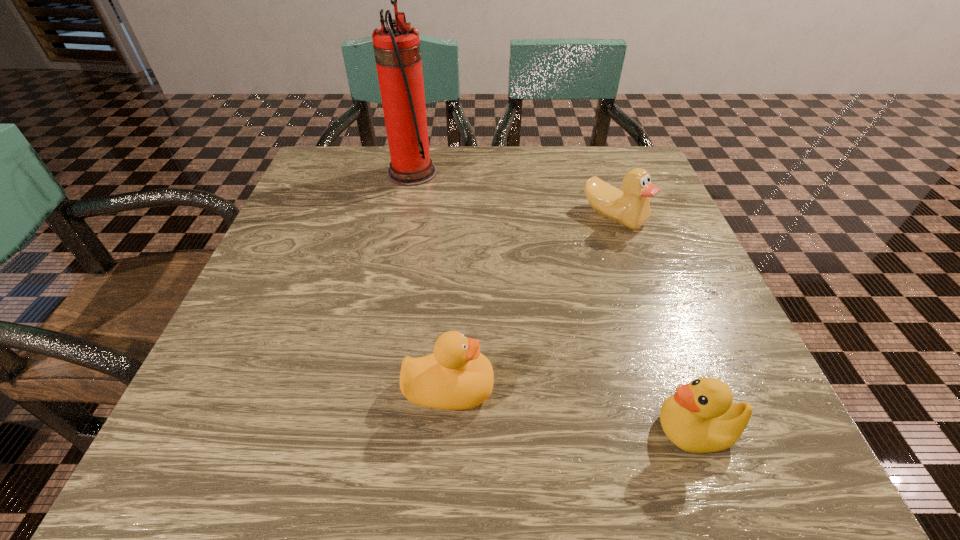
The image size is (960, 540). In order to click on the tallest object in this screenshot , I will do click(x=397, y=50).

Locate an element on the screen. the farthest object is located at coordinates (397, 50).

Identify the location of the farthest duck. The width and height of the screenshot is (960, 540). (630, 208).

Identify the location of the leftmost duck. (456, 376).

Find the location of a particular element. Image resolution: width=960 pixels, height=540 pixels. free space located 0.280m at the discharge end of the fire extinguisher is located at coordinates (553, 173).

At what (x,y) coordinates should I click in order to perform the action: click on vacant area situated at the beak of the farthest duck. Please return your answer as a coordinate pair (x, y). Image resolution: width=960 pixels, height=540 pixels. Looking at the image, I should click on (674, 388).

Identify the location of vacant area situated 0.240m on the face of the leftmost duck. (657, 388).

Locate an element on the screen. The height and width of the screenshot is (540, 960). fire extinguisher that is at the far edge is located at coordinates (397, 50).

Locate an element on the screen. The image size is (960, 540). duck located at the far edge is located at coordinates (630, 208).

At what (x,y) coordinates should I click in order to perform the action: click on object present at the far right corner. Please return your answer as a coordinate pair (x, y). This screenshot has height=540, width=960. Looking at the image, I should click on (630, 208).